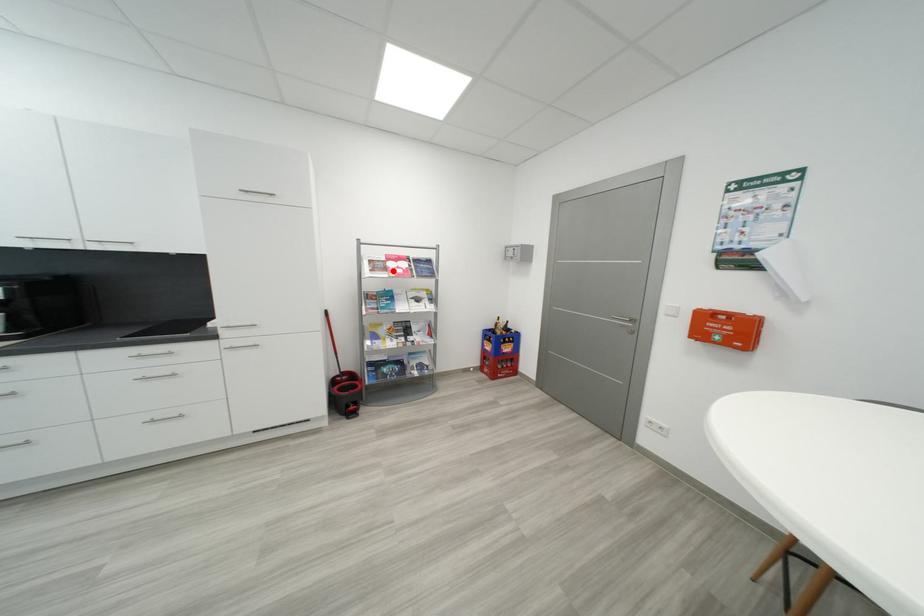
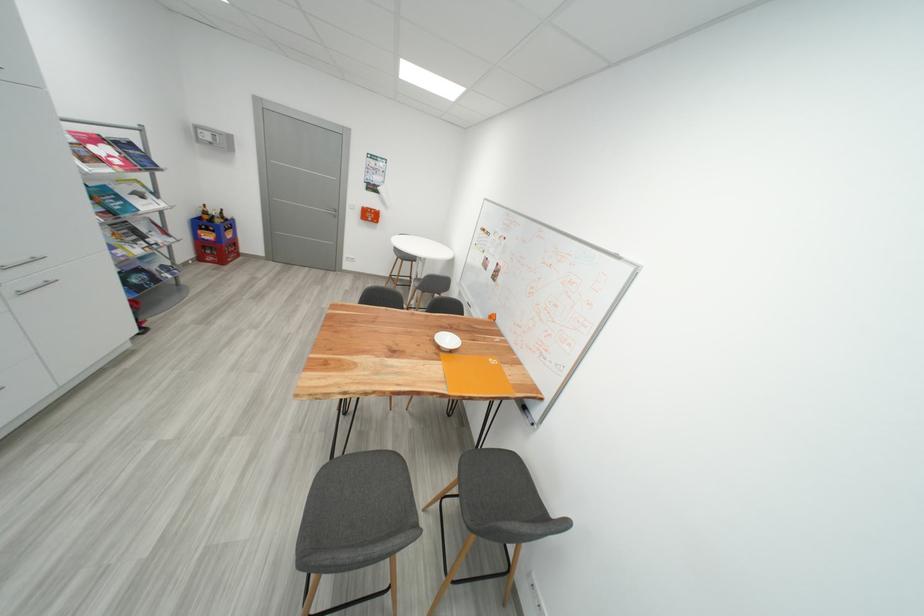
Question: I am providing you with two images of the same scene from different viewpoints. In image1, a red point is highlighted. Considering the same 3D point in image2, which of the following is correct?

Choices:
 (A) It is closer
 (B) It is farther

Answer: (B)